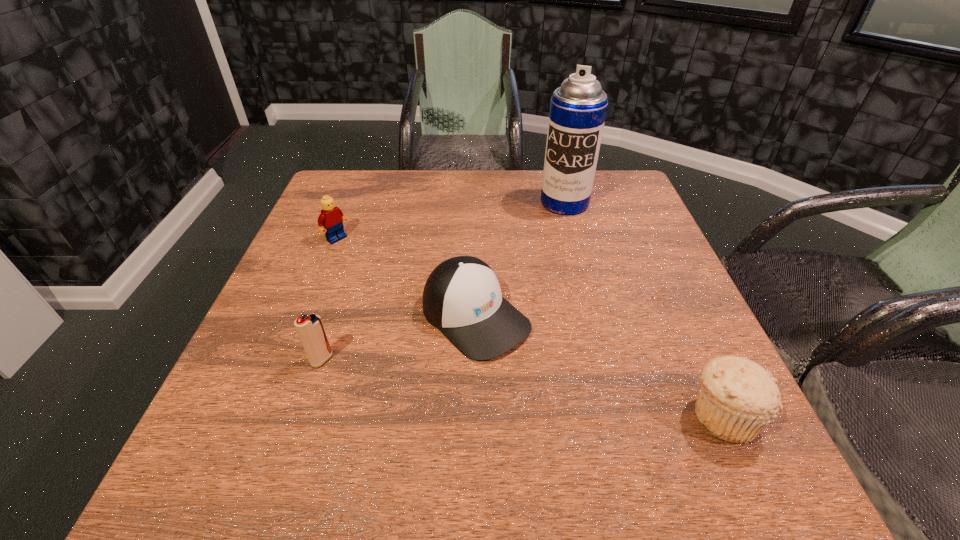
Identify the location of the second object from left to right. This screenshot has width=960, height=540. (310, 329).

Identify the location of the rightmost object. Image resolution: width=960 pixels, height=540 pixels. (738, 399).

Find the location of a particular element. muffin is located at coordinates (738, 399).

At what (x,y) coordinates should I click in order to perform the action: click on the tallest object. Please return your answer as a coordinate pair (x, y). Looking at the image, I should click on (578, 108).

Find the location of a particular element. the fourth object from left to right is located at coordinates (578, 108).

In order to click on the fourth nearest object in this screenshot , I will do `click(331, 220)`.

The width and height of the screenshot is (960, 540). I want to click on the leftmost object, so click(331, 220).

You are a GUI agent. You are given a task and a screenshot of the screen. Output one action in this format:
    pyautogui.click(x=<x>, y=<y>)
    Task: Click on the cap
    The image size is (960, 540).
    Given the screenshot: What is the action you would take?
    pyautogui.click(x=462, y=298)

At what (x,y) coordinates should I click in order to perform the action: click on vacant space located 0.170m on the right of the second object from left to right. Please return your answer as a coordinate pair (x, y). The height and width of the screenshot is (540, 960). Looking at the image, I should click on (423, 360).

You are a GUI agent. You are given a task and a screenshot of the screen. Output one action in this format:
    pyautogui.click(x=<x>, y=<y>)
    Task: Click on the vacant space situated 0.160m on the left of the nearest object
    This screenshot has height=540, width=960.
    Given the screenshot: What is the action you would take?
    pyautogui.click(x=591, y=415)